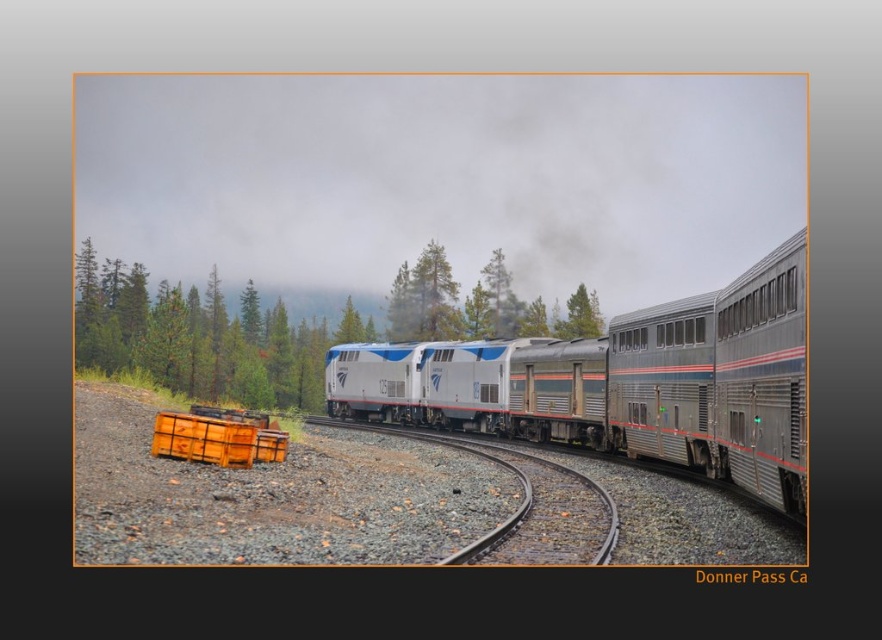
Between silver metallic train at center and metal/smooth train track at center, which one appears on the left side from the viewer's perspective?

From the viewer's perspective, metal/smooth train track at center appears more on the left side.

From the picture: Can you confirm if silver metallic train at center is bigger than metal/smooth train track at center?

Yes, silver metallic train at center is bigger than metal/smooth train track at center.

Does point (415, 397) lie in front of point (484, 536)?

No, it is behind (484, 536).

The image size is (882, 640). I want to click on silver metallic train at center, so click(x=623, y=381).

Is silver metallic train at center thinner than green leafy tree at center?

Indeed, silver metallic train at center has a lesser width compared to green leafy tree at center.

Is silver metallic train at center wider than green leafy tree at center?

Incorrect, silver metallic train at center's width does not surpass green leafy tree at center's.

Is point (529, 387) farther from camera compared to point (584, 296)?

That is False.

Find the location of a particular element. Image resolution: width=882 pixels, height=640 pixels. silver metallic train at center is located at coordinates (623, 381).

Does green leafy tree at center appear on the right side of metal/smooth train track at center?

Incorrect, green leafy tree at center is not on the right side of metal/smooth train track at center.

Can you confirm if green leafy tree at center is shorter than metal/smooth train track at center?

No.

Who is more distant from viewer, (462, 332) or (521, 458)?

Point (462, 332)

You are a GUI agent. You are given a task and a screenshot of the screen. Output one action in this format:
    pyautogui.click(x=<x>, y=<y>)
    Task: Click on the green leafy tree at center
    
    Given the screenshot: What is the action you would take?
    pyautogui.click(x=202, y=337)